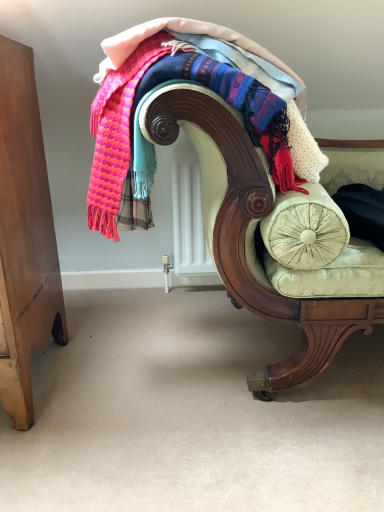
Question: Based on their positions, is knitted wool scarf at upper center located to the left or right of velvet green chaise at center?

Choices:
 (A) right
 (B) left

Answer: (B)

Question: Is knitted wool scarf at upper center wider or thinner than velvet green chaise at center?

Choices:
 (A) wide
 (B) thin

Answer: (B)

Question: Relative to velvet green chaise at center, is knitted wool scarf at upper center in front or behind?

Choices:
 (A) front
 (B) behind

Answer: (B)

Question: From a real-world perspective, is velvet green chaise at center above or below knitted wool scarf at upper center?

Choices:
 (A) below
 (B) above

Answer: (A)

Question: Is point tap(273, 392) positioned closer to the camera than point tap(142, 202)?

Choices:
 (A) closer
 (B) farther

Answer: (B)

Question: Considering the positions of velvet green chaise at center and knitted wool scarf at upper center in the image, is velvet green chaise at center wider or thinner than knitted wool scarf at upper center?

Choices:
 (A) thin
 (B) wide

Answer: (B)

Question: Is velvet green chaise at center taller or shorter than knitted wool scarf at upper center?

Choices:
 (A) short
 (B) tall

Answer: (B)